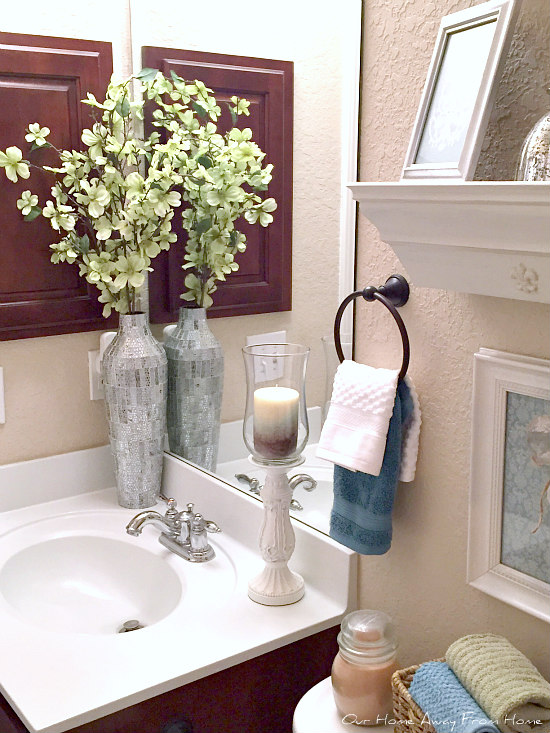
Locate an element on the screen. The height and width of the screenshot is (733, 550). electrical outlet is located at coordinates (99, 377).